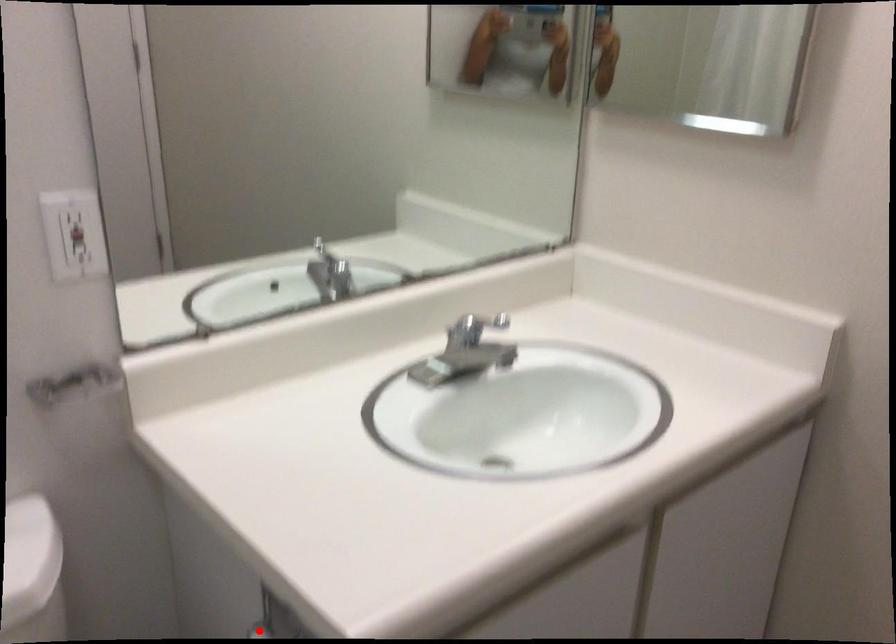
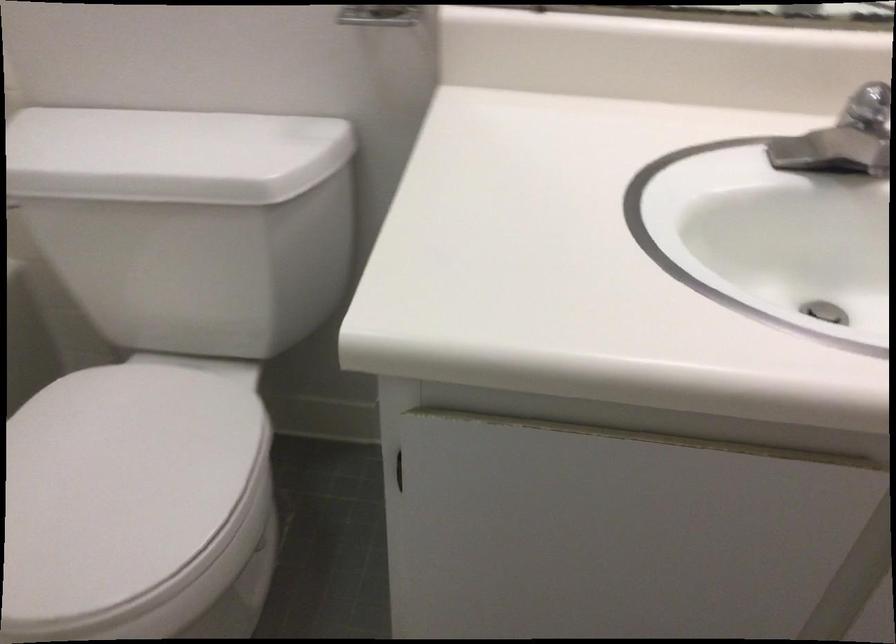
Question: I am providing you with two images of the same scene from different viewpoints. A red point is marked on the first image. Can you still see the location of the red point in image 2?

Choices:
 (A) Yes
 (B) No

Answer: (B)